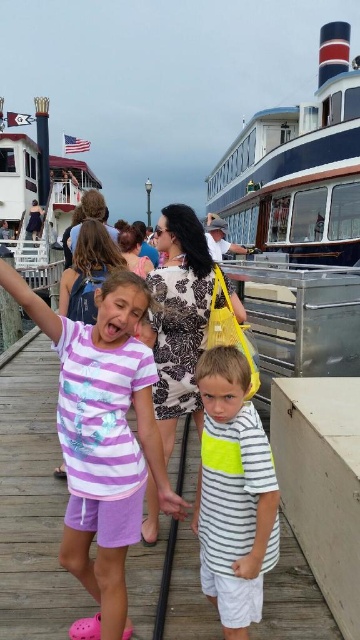
Which is more to the left, blue polished wood boat at upper center or purple striped shirt at center?

purple striped shirt at center

This screenshot has width=360, height=640. What do you see at coordinates (300, 221) in the screenshot?
I see `blue polished wood boat at upper center` at bounding box center [300, 221].

This screenshot has height=640, width=360. Identify the location of blue polished wood boat at upper center. (300, 221).

Which is above, purple striped shirt at center or striped cotton shirt at center?

purple striped shirt at center is above.

Between purple striped shirt at center and striped cotton shirt at center, which one has less height?

striped cotton shirt at center is shorter.

The height and width of the screenshot is (640, 360). Describe the element at coordinates (102, 387) in the screenshot. I see `purple striped shirt at center` at that location.

This screenshot has width=360, height=640. Identify the location of purple striped shirt at center. (102, 387).

Is blue polished wood boat at upper center shorter than white wooden boat at upper left?

No.

Does blue polished wood boat at upper center appear on the right side of white wooden boat at upper left?

Yes, blue polished wood boat at upper center is to the right of white wooden boat at upper left.

The height and width of the screenshot is (640, 360). In order to click on blue polished wood boat at upper center in this screenshot , I will do `click(300, 221)`.